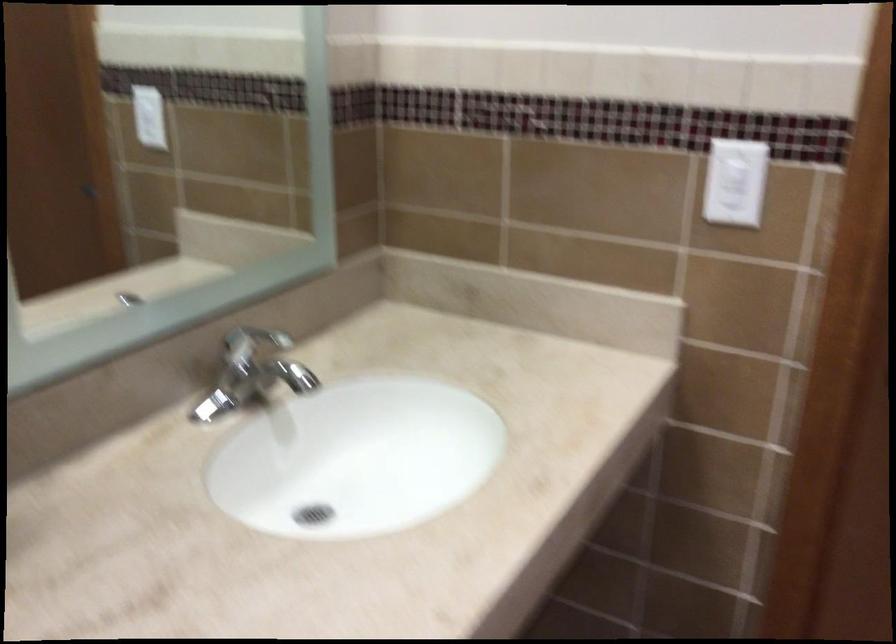
The height and width of the screenshot is (644, 896). What do you see at coordinates (252, 373) in the screenshot?
I see `the faucet handle` at bounding box center [252, 373].